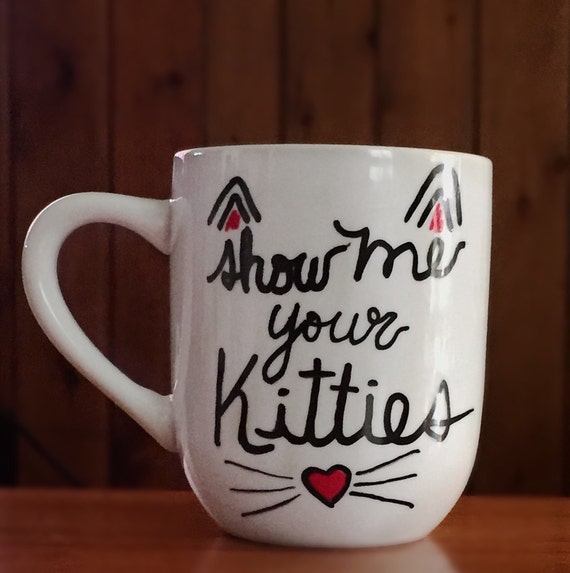
You are a GUI agent. You are given a task and a screenshot of the screen. Output one action in this format:
    pyautogui.click(x=<x>, y=<y>)
    Task: Click on the wooden wall
    The height and width of the screenshot is (573, 570).
    Given the screenshot: What is the action you would take?
    pyautogui.click(x=335, y=92)